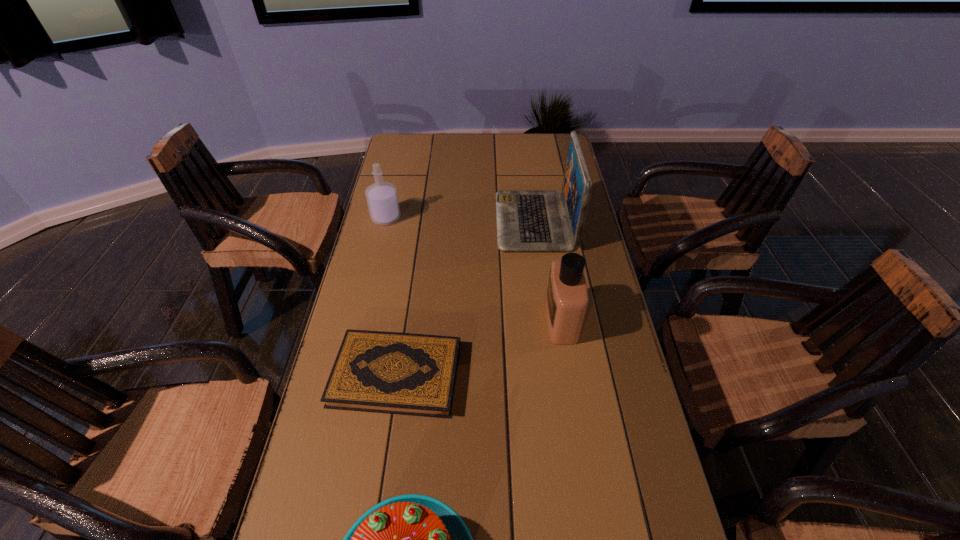
Locate an element on the screen. vacant space that satisfies the following two spatial constraints: 1. on the front side of the left perfume; 2. on the right side of the shortest object is located at coordinates (348, 374).